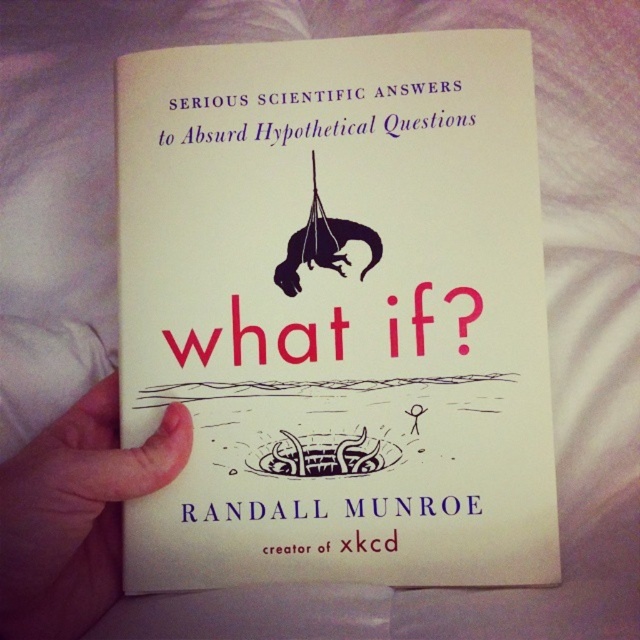
Who is taller, white paper book at center or white skin at lower left?

white paper book at center is taller.

Where is `white paper book at center`? This screenshot has height=640, width=640. white paper book at center is located at coordinates (337, 310).